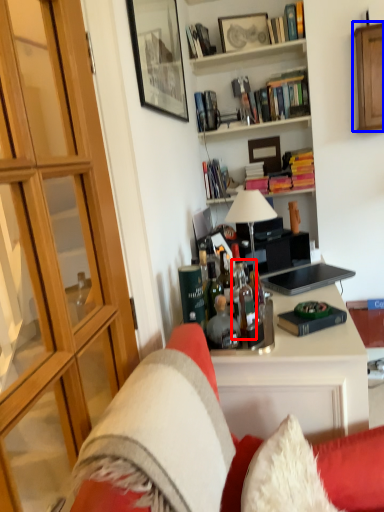
Question: Among these objects, which one is farthest to the camera, bottle (highlighted by a red box) or cabinetry (highlighted by a blue box)?

Choices:
 (A) bottle
 (B) cabinetry

Answer: (B)